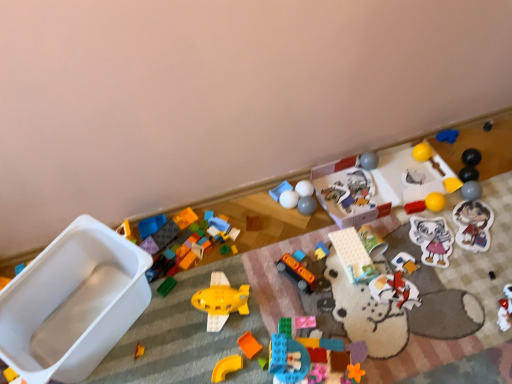
Identify the location of vacant area that lies between yellow matte square at center-right, which is the 4th toy in right-to-left order, and yellow plastic curve at center, the fifth toy in the left-to-right sequence. The height and width of the screenshot is (384, 512). (351, 268).